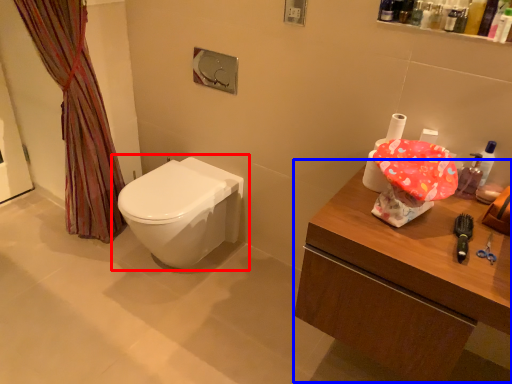
Question: Which of the following is the farthest to the observer, toilet (highlighted by a red box) or counter (highlighted by a blue box)?

Choices:
 (A) toilet
 (B) counter

Answer: (A)